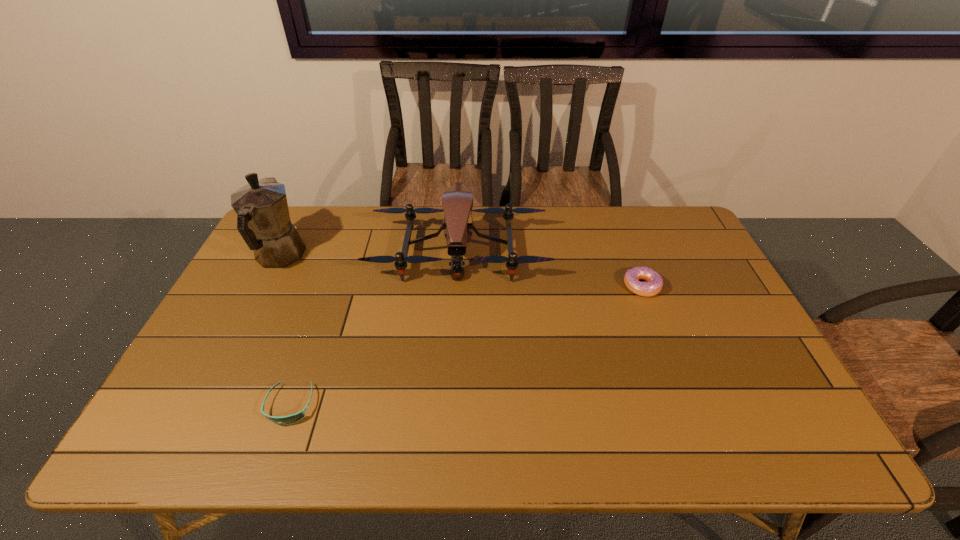
At what (x,y) coordinates should I click in order to perform the action: click on free space between the third object from left to right and the doughnut. Please return your answer as a coordinate pair (x, y). This screenshot has height=540, width=960. Looking at the image, I should click on (550, 269).

Where is `vacant region between the rightmost object and the second object from left to right`? The image size is (960, 540). vacant region between the rightmost object and the second object from left to right is located at coordinates (466, 346).

This screenshot has height=540, width=960. Find the location of `free spot between the second tallest object and the coffeepot`. free spot between the second tallest object and the coffeepot is located at coordinates (369, 254).

You are a GUI agent. You are given a task and a screenshot of the screen. Output one action in this format:
    pyautogui.click(x=<x>, y=<y>)
    Task: Click on the empty location between the sunglasses and the rightmost object
    Image resolution: width=960 pixels, height=540 pixels.
    Given the screenshot: What is the action you would take?
    pyautogui.click(x=466, y=346)

Where is `vacant region between the doughnut and the shortest object`? vacant region between the doughnut and the shortest object is located at coordinates (466, 346).

What are the coordinates of `free space between the coffeepot and the drone` in the screenshot? It's located at (369, 254).

Image resolution: width=960 pixels, height=540 pixels. What are the coordinates of `free space between the third object from right to left and the leftmost object` in the screenshot? It's located at (285, 331).

Point out which object is positioned as the second nearest to the second tallest object. Please provide its 2D coordinates. Your answer should be formatted as a tuple, i.e. [(x, y)], where the tuple contains the x and y coordinates of a point satisfying the conditions above.

[(654, 285)]

This screenshot has width=960, height=540. Identify the location of object that stands as the second closest to the leftmost object. (293, 418).